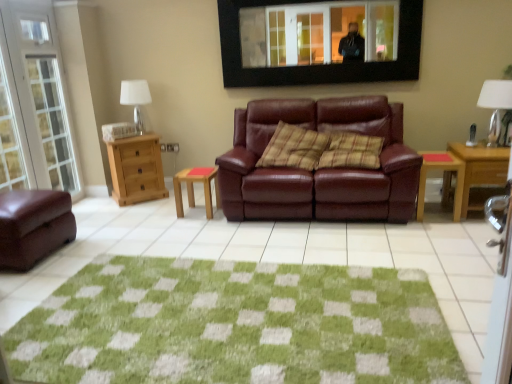
Question: From the image's perspective, is wooden stool at center, marked as the first table in a left-to-right arrangement, below matte leather couch at center, which is the first studio couch from right to left?

Choices:
 (A) no
 (B) yes

Answer: (B)

Question: Is wooden stool at center, marked as the first table in a left-to-right arrangement, looking in the opposite direction of matte leather couch at center, which is the first studio couch from right to left?

Choices:
 (A) yes
 (B) no

Answer: (B)

Question: Can we say wooden stool at center, the second table from the right, lies outside matte leather couch at center, acting as the second studio couch starting from the left?

Choices:
 (A) no
 (B) yes

Answer: (B)

Question: Is wooden stool at center, the second table from the right, to the right of matte leather couch at center, which is the first studio couch from right to left, from the viewer's perspective?

Choices:
 (A) no
 (B) yes

Answer: (A)

Question: Is matte leather couch at center, which is the first studio couch from right to left, inside wooden stool at center, marked as the first table in a left-to-right arrangement?

Choices:
 (A) yes
 (B) no

Answer: (B)

Question: Is wooden stool at center, marked as the first table in a left-to-right arrangement, positioned behind matte leather couch at center, acting as the second studio couch starting from the left?

Choices:
 (A) yes
 (B) no

Answer: (A)

Question: Is white fabric lampshade at upper right, which appears as the 2th lamp when viewed from the back, outside plaid fabric pillow at center?

Choices:
 (A) no
 (B) yes

Answer: (B)

Question: Is white fabric lampshade at upper right, the first lamp when ordered from right to left, facing towards plaid fabric pillow at center?

Choices:
 (A) yes
 (B) no

Answer: (B)

Question: Does white fabric lampshade at upper right, the 2th lamp from the left, lie behind plaid fabric pillow at center?

Choices:
 (A) yes
 (B) no

Answer: (B)

Question: From a real-world perspective, is white fabric lampshade at upper right, the 1th lamp viewed from the front, on plaid fabric pillow at center?

Choices:
 (A) yes
 (B) no

Answer: (A)

Question: Considering the relative sizes of white fabric lampshade at upper right, the 2th lamp from the left, and plaid fabric pillow at center in the image provided, is white fabric lampshade at upper right, the 2th lamp from the left, wider than plaid fabric pillow at center?

Choices:
 (A) yes
 (B) no

Answer: (B)

Question: From the image's perspective, is white fabric lampshade at upper right, which appears as the 2th lamp when viewed from the back, located beneath plaid fabric pillow at center?

Choices:
 (A) yes
 (B) no

Answer: (B)

Question: Is green textured rug at center in front of black framed mirror at upper center?

Choices:
 (A) no
 (B) yes

Answer: (B)